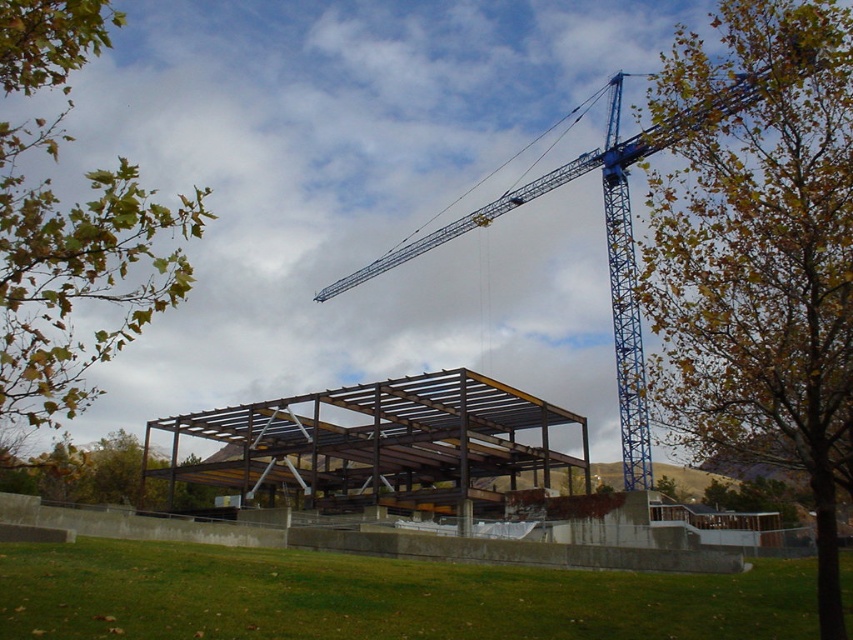
Can you confirm if green leafy branches at upper left is shorter than blue metallic crane at center?

Incorrect, green leafy branches at upper left's height does not fall short of blue metallic crane at center's.

How much distance is there between green leafy branches at upper left and blue metallic crane at center?

They are 151.67 feet apart.

This screenshot has width=853, height=640. I want to click on green leafy branches at upper left, so click(x=77, y=272).

Does brown leafy tree at upper right have a greater height compared to green leafy branches at upper left?

Correct, brown leafy tree at upper right is much taller as green leafy branches at upper left.

Is brown leafy tree at upper right to the left of green leafy branches at upper left from the viewer's perspective?

In fact, brown leafy tree at upper right is to the right of green leafy branches at upper left.

Describe the element at coordinates (759, 257) in the screenshot. This screenshot has width=853, height=640. I see `brown leafy tree at upper right` at that location.

At what (x,y) coordinates should I click in order to perform the action: click on brown leafy tree at upper right. Please return your answer as a coordinate pair (x, y). The height and width of the screenshot is (640, 853). Looking at the image, I should click on (759, 257).

Is brown leafy tree at upper right below metal/structurally sound roof at center?

No.

Does brown leafy tree at upper right have a smaller size compared to metal/structurally sound roof at center?

No.

This screenshot has height=640, width=853. I want to click on brown leafy tree at upper right, so click(759, 257).

Locate an element on the screen. The image size is (853, 640). brown leafy tree at upper right is located at coordinates (759, 257).